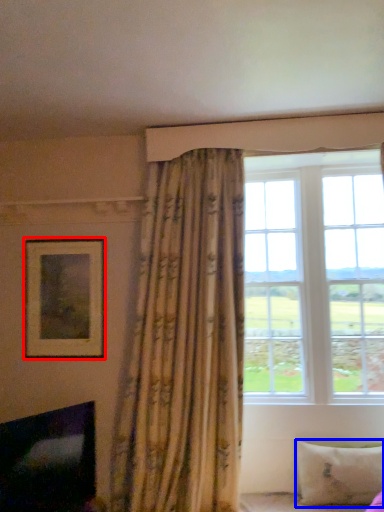
Question: Which object is further to the camera taking this photo, picture frame (highlighted by a red box) or pillow (highlighted by a blue box)?

Choices:
 (A) picture frame
 (B) pillow

Answer: (A)